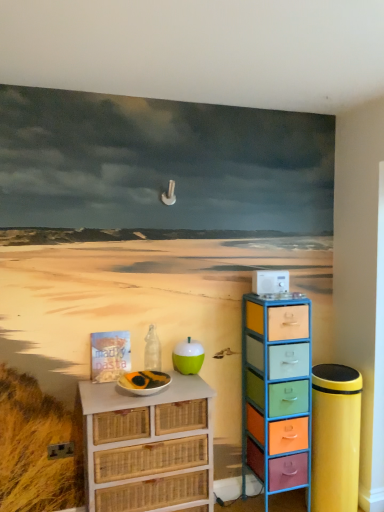
Question: Is transparent glass bottle at center shorter than teal glossy apple at center?

Choices:
 (A) yes
 (B) no

Answer: (B)

Question: Is teal glossy apple at center completely or partially inside transparent glass bottle at center?

Choices:
 (A) yes
 (B) no

Answer: (B)

Question: Does transparent glass bottle at center have a lesser width compared to teal glossy apple at center?

Choices:
 (A) yes
 (B) no

Answer: (A)

Question: From a real-world perspective, is transparent glass bottle at center under teal glossy apple at center?

Choices:
 (A) no
 (B) yes

Answer: (A)

Question: Is transparent glass bottle at center at the left side of teal glossy apple at center?

Choices:
 (A) no
 (B) yes

Answer: (B)

Question: Does transparent glass bottle at center lie behind teal glossy apple at center?

Choices:
 (A) no
 (B) yes

Answer: (B)

Question: Is transparent glass bottle at center closer to the viewer compared to multicolored plastic drawers at right, which is counted as the second chest of drawers, starting from the left?

Choices:
 (A) no
 (B) yes

Answer: (A)

Question: Is transparent glass bottle at center behind multicolored plastic drawers at right, which is counted as the second chest of drawers, starting from the left?

Choices:
 (A) yes
 (B) no

Answer: (A)

Question: Considering the relative sizes of transparent glass bottle at center and multicolored plastic drawers at right, which is counted as the second chest of drawers, starting from the left, in the image provided, is transparent glass bottle at center thinner than multicolored plastic drawers at right, which is counted as the second chest of drawers, starting from the left,?

Choices:
 (A) no
 (B) yes

Answer: (B)

Question: Does transparent glass bottle at center turn towards multicolored plastic drawers at right, the first chest of drawers when ordered from right to left?

Choices:
 (A) yes
 (B) no

Answer: (B)

Question: From a real-world perspective, is transparent glass bottle at center physically below multicolored plastic drawers at right, the first chest of drawers when ordered from right to left?

Choices:
 (A) yes
 (B) no

Answer: (B)

Question: Does transparent glass bottle at center have a larger size compared to multicolored plastic drawers at right, which is counted as the second chest of drawers, starting from the left?

Choices:
 (A) yes
 (B) no

Answer: (B)

Question: From a real-world perspective, is white wicker chest of drawers at lower left, the second chest of drawers from the right, located beneath transparent glass bottle at center?

Choices:
 (A) no
 (B) yes

Answer: (B)